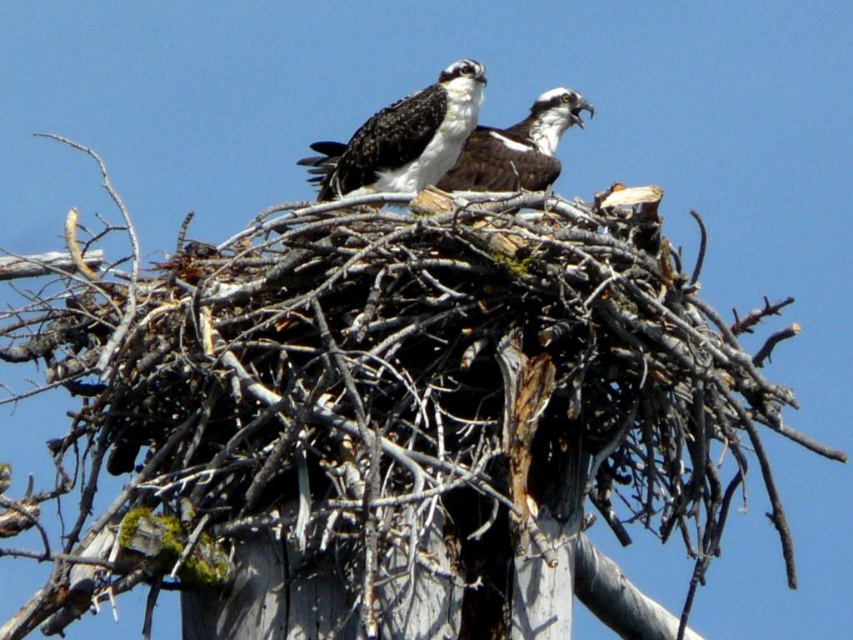
Question: Can you confirm if black and white feathers at center is thinner than white glossy bird at center?

Choices:
 (A) no
 (B) yes

Answer: (B)

Question: Is black and white feathers at center wider than white glossy bird at center?

Choices:
 (A) yes
 (B) no

Answer: (B)

Question: Can you confirm if black and white feathers at center is thinner than white glossy bird at center?

Choices:
 (A) no
 (B) yes

Answer: (B)

Question: Which point appears farthest from the camera in this image?

Choices:
 (A) (444, 88)
 (B) (474, 156)

Answer: (B)

Question: Which object is farther from the camera taking this photo?

Choices:
 (A) black and white feathers at center
 (B) white glossy bird at center

Answer: (B)

Question: Which point appears closest to the camera in this image?

Choices:
 (A) (434, 177)
 (B) (477, 147)

Answer: (A)